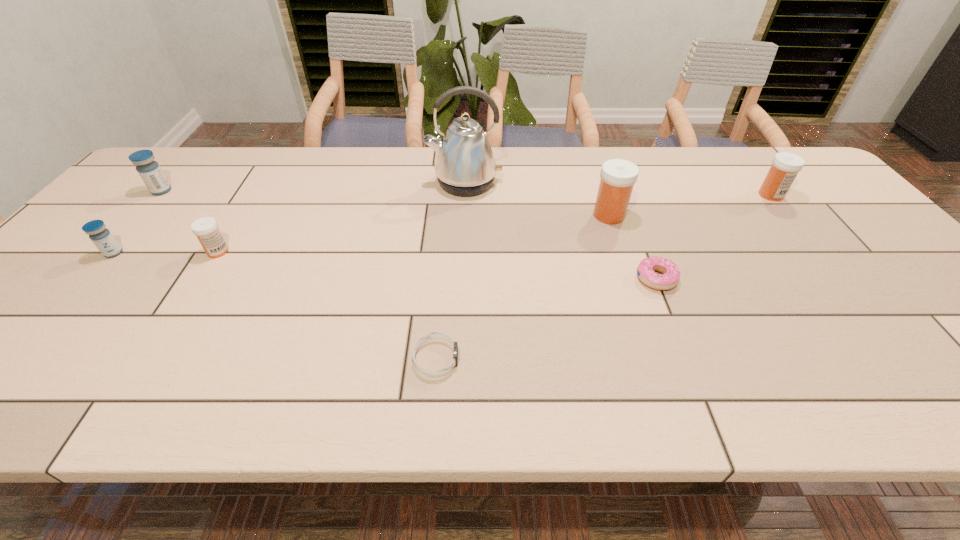
Locate an element on the screen. The width and height of the screenshot is (960, 540). doughnut is located at coordinates (669, 278).

Where is `wristband`? This screenshot has width=960, height=540. wristband is located at coordinates (432, 335).

Where is `blank space located on the front of the kettle`? This screenshot has height=540, width=960. blank space located on the front of the kettle is located at coordinates (463, 222).

Identify the location of free location located 0.120m on the right of the tallest medicine. (669, 215).

The width and height of the screenshot is (960, 540). What are the coordinates of `vacant space located 0.240m on the front of the farther blue medicine` in the screenshot? It's located at [108, 251].

The image size is (960, 540). In order to click on vacant area situated on the left of the rightmost object in this screenshot , I will do `click(663, 195)`.

I want to click on free spot located on the front of the leftmost white medicine, so click(203, 276).

You are a GUI agent. You are given a task and a screenshot of the screen. Output one action in this format:
    pyautogui.click(x=<x>, y=<y>)
    Task: Click on the free spot located on the front of the nearer blue medicine
    This screenshot has width=960, height=540.
    Given the screenshot: What is the action you would take?
    pyautogui.click(x=72, y=301)

This screenshot has width=960, height=540. Identify the location of free location located 0.290m on the right of the second nearest object. (798, 279).

This screenshot has height=540, width=960. What are the coordinates of `vacant space situated 0.140m on the outer surface of the wristband` in the screenshot? It's located at (527, 359).